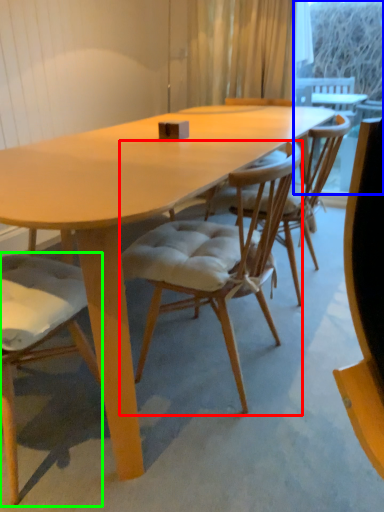
Question: Which is farther away from chair (highlighted by a red box)? window screen (highlighted by a blue box) or chair (highlighted by a green box)?

Choices:
 (A) window screen
 (B) chair

Answer: (A)